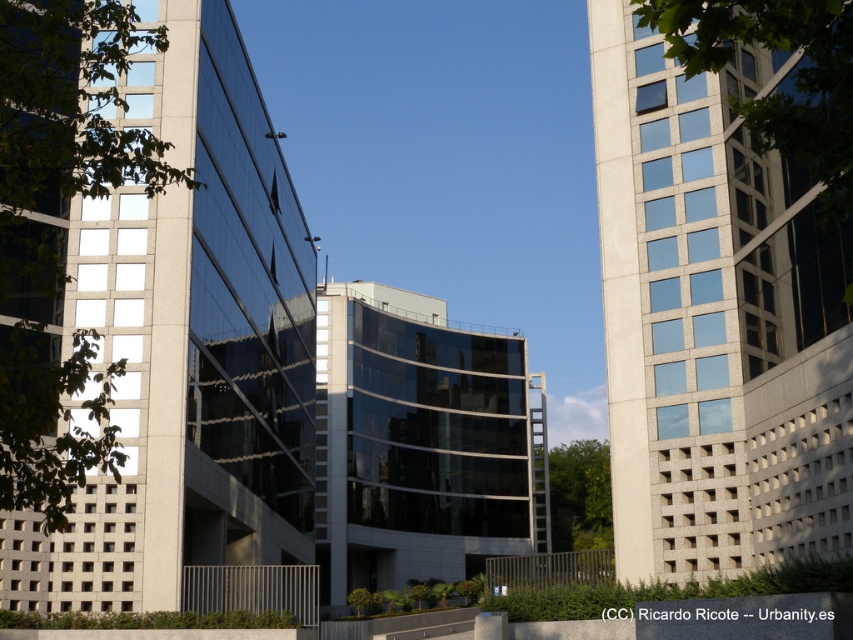
You are an architect evaluating the urban skyline. You need to determine which building is taller between the white textured building at right and the glossy glass building at center. Based on the scene, which one is taller?

The glossy glass building at center is taller than the white textured building at right.

You are an urban planner analyzing the layout of this city block. You need to determine the relative positions of the matte glass building at center and the white textured building at right. Based on the scene, which building is positioned to the left of the other?

The matte glass building at center is to the left of white textured building at right.

You are standing in front of the urban architectural scene described. You want to take a photo of the matte glass building at center. Considering your camera can focus on objects up to 25 meters away, will you be able to capture a clear image?

The matte glass building at center is 23.66 meters away from viewer, so yes, the camera can focus on it clearly since it is within the 25 meters range.